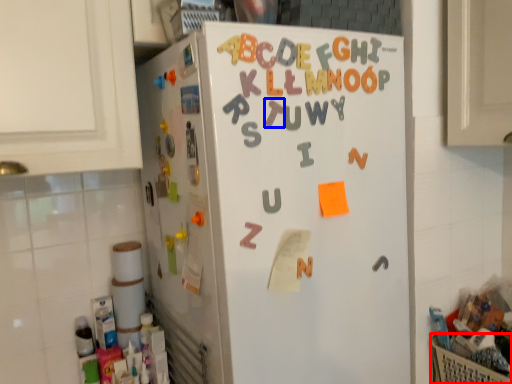
Question: Which point is further to the camera, basket (highlighted by a red box) or letter (highlighted by a blue box)?

Choices:
 (A) basket
 (B) letter

Answer: (A)